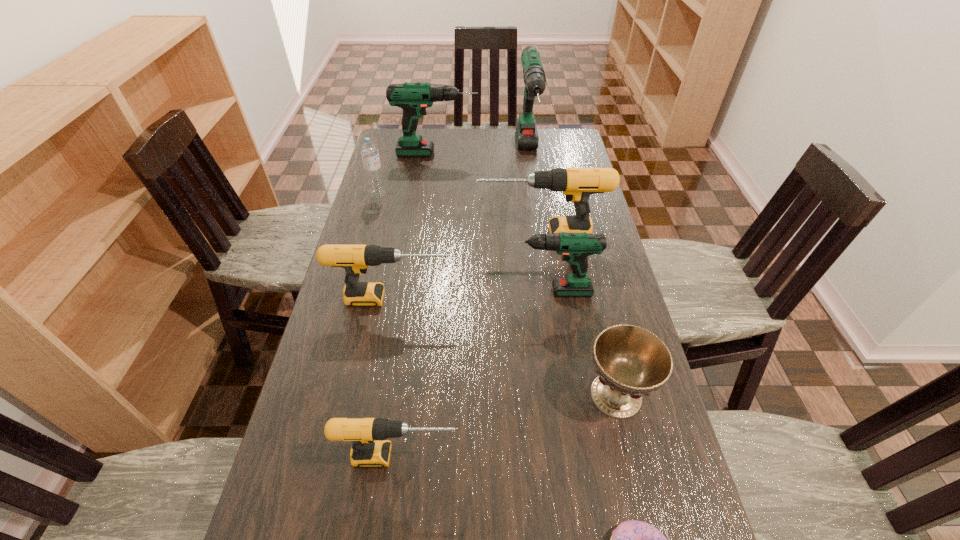
At what (x,y) coordinates should I click in order to perform the action: click on blank space located on the handle side of the smallest green drill. Please return your answer as a coordinate pair (x, y). This screenshot has height=540, width=960. Looking at the image, I should click on (405, 291).

At what (x,y) coordinates should I click in order to perform the action: click on free region located 0.170m on the handle side of the second farthest black drill. Please return your answer as a coordinate pair (x, y). The image size is (960, 540). Looking at the image, I should click on (511, 298).

In order to click on vacant space located 0.210m on the front of the seventh farthest object in this screenshot , I will do `click(649, 534)`.

This screenshot has width=960, height=540. I want to click on free space located 0.150m on the handle side of the nearest black drill, so click(x=528, y=456).

Find the location of a particular element. The width and height of the screenshot is (960, 540). water bottle at the left edge is located at coordinates (369, 151).

The width and height of the screenshot is (960, 540). I want to click on chalice that is at the right edge, so click(631, 361).

This screenshot has height=540, width=960. I want to click on object that is at the far left corner, so click(414, 98).

Locate an element on the screen. The width and height of the screenshot is (960, 540). vacant space at the far edge is located at coordinates (477, 138).

The image size is (960, 540). In the image, there is a desktop. Identify the location of vacant space at the left edge. (342, 331).

At what (x,y) coordinates should I click in order to perform the action: click on vacant space at the right edge of the desktop. Please return your answer as a coordinate pair (x, y). This screenshot has height=540, width=960. Looking at the image, I should click on (593, 431).